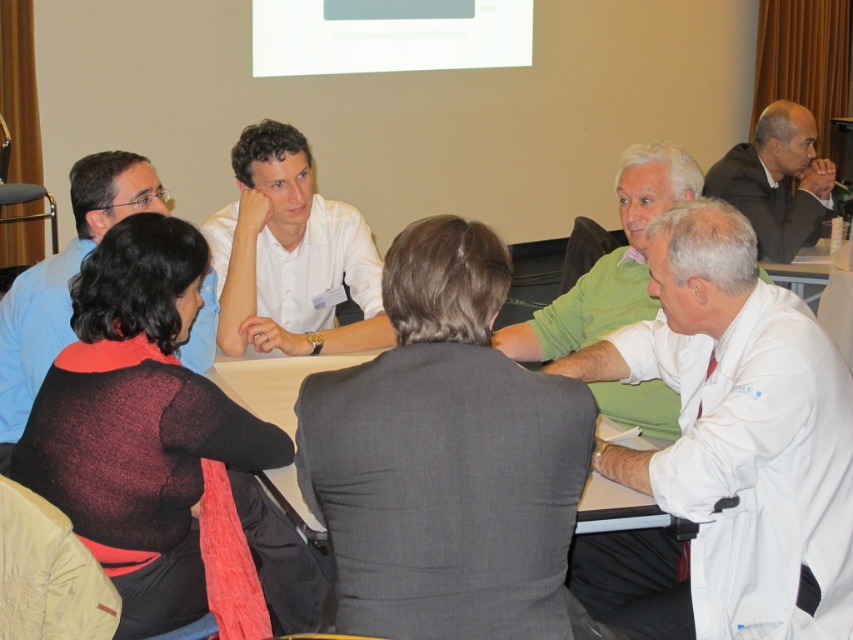
Is white smooth shirt at center above matte black sweater at left?

Yes.

Find the location of a particular element. The image size is (853, 640). white smooth shirt at center is located at coordinates (292, 252).

Is white lab coat at center closer to camera compared to matte black sweater at left?

That is True.

This screenshot has width=853, height=640. What do you see at coordinates (727, 449) in the screenshot?
I see `white lab coat at center` at bounding box center [727, 449].

Locate an element on the screen. The height and width of the screenshot is (640, 853). white lab coat at center is located at coordinates (727, 449).

Between matte black sweater at left and dark gray suit at upper right, which one appears on the right side from the viewer's perspective?

Positioned to the right is dark gray suit at upper right.

Does matte black sweater at left have a larger size compared to dark gray suit at upper right?

Actually, matte black sweater at left might be smaller than dark gray suit at upper right.

Image resolution: width=853 pixels, height=640 pixels. Identify the location of matte black sweater at left. (62, 280).